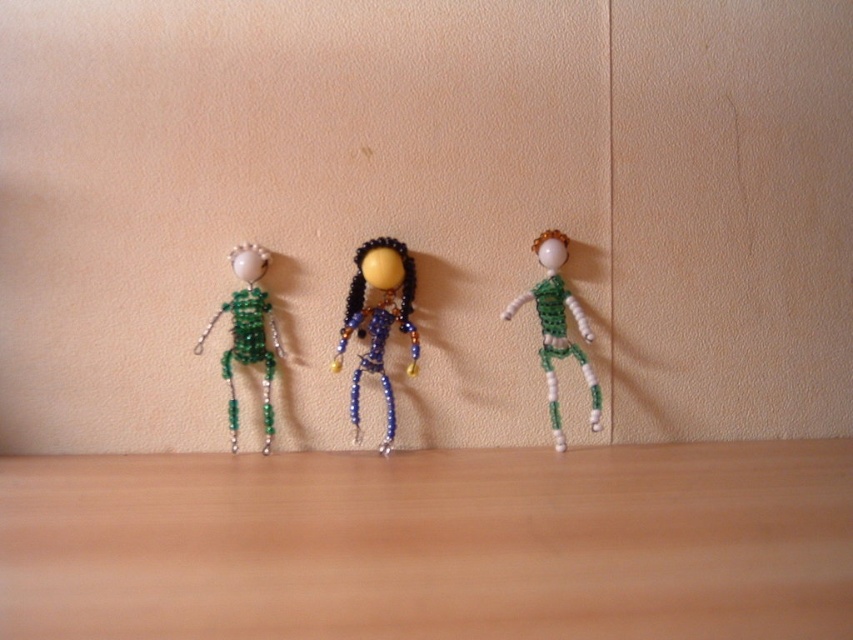
Question: Is green beaded figure at right smaller than green beaded doll at left?

Choices:
 (A) yes
 (B) no

Answer: (B)

Question: Which point is farther to the camera?

Choices:
 (A) (544, 340)
 (B) (390, 298)

Answer: (A)

Question: Which point is closer to the camera taking this photo?

Choices:
 (A) [x=396, y=253]
 (B) [x=544, y=337]

Answer: (A)

Question: Observing the image, what is the correct spatial positioning of blue beaded doll at center in reference to green beaded figure at right?

Choices:
 (A) left
 (B) right

Answer: (A)

Question: Can you confirm if blue beaded doll at center is positioned above green beaded figure at right?

Choices:
 (A) yes
 (B) no

Answer: (B)

Question: Estimate the real-world distances between objects in this image. Which object is farther from the blue beaded doll at center?

Choices:
 (A) green beaded figure at right
 (B) wooden table at lower center
 (C) green beaded doll at left

Answer: (B)